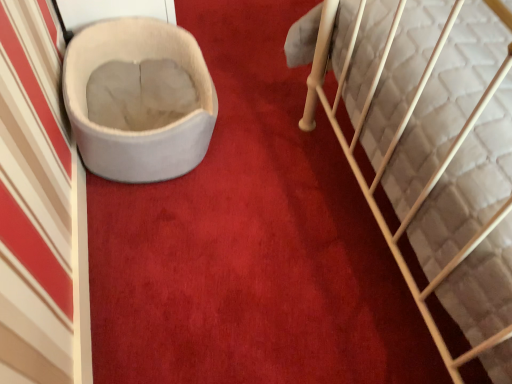
Identify the location of unoccupied region to the right of white plush cat bed at left. The image size is (512, 384). (271, 137).